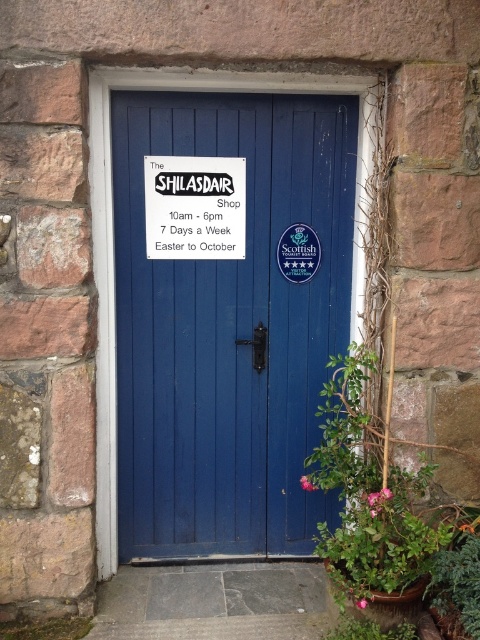
Question: Which is farther from the white paper sign at center?

Choices:
 (A) blue wooden door at center
 (B) green leafy plant at right
 (C) green leafy plant at lower right

Answer: (C)

Question: Which of the following is the farthest from the observer?

Choices:
 (A) (240, 344)
 (B) (420, 515)
 (C) (458, 616)
 (D) (236, 216)

Answer: (A)

Question: Does blue wooden door at center appear under green leafy plant at lower right?

Choices:
 (A) yes
 (B) no

Answer: (B)

Question: Which point is closer to the camera?

Choices:
 (A) blue wooden door at center
 (B) white paper sign at center
 (C) green leafy plant at lower right
 (D) green leafy plant at right

Answer: (C)

Question: Can you confirm if blue wooden door at center is wider than green leafy plant at right?

Choices:
 (A) no
 (B) yes

Answer: (B)

Question: Is blue wooden door at center thinner than white paper sign at center?

Choices:
 (A) yes
 (B) no

Answer: (B)